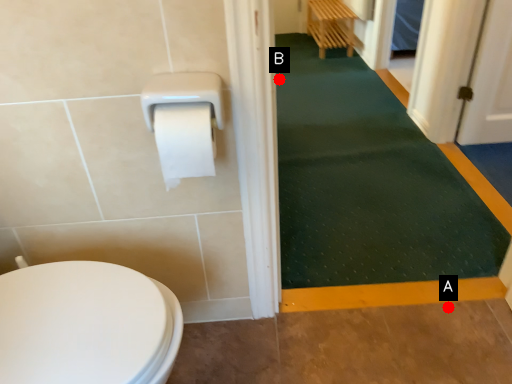
Question: Two points are circled on the image, labeled by A and B beside each circle. Which point is farther to the camera?

Choices:
 (A) A is further
 (B) B is further

Answer: (B)